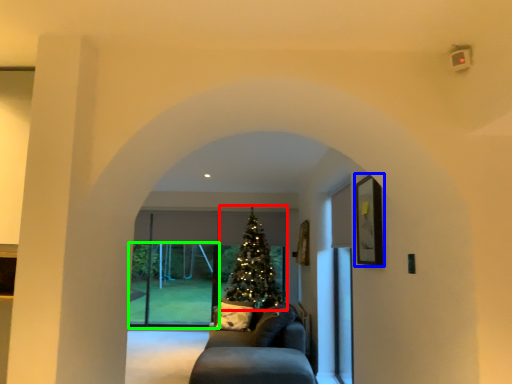
Question: Estimate the real-world distances between objects in this image. Which object is closer to christmas tree (highlighted by a red box), picture frame (highlighted by a blue box) or glass door (highlighted by a green box)?

Choices:
 (A) picture frame
 (B) glass door

Answer: (B)